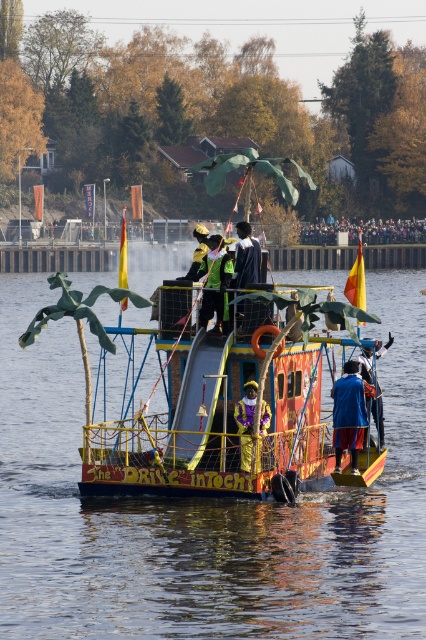
You are a photographer trying to capture both the smooth wooden boat at center and the shiny gold helmet at center in a single shot. Considering their sizes, which object should you focus on first to ensure both are in frame?

Since the smooth wooden boat at center is taller than the shiny gold helmet at center, you should focus on positioning the camera to include the taller boat first, then adjust to include the helmet within the same frame.

You are a photographer on the boat during the parade. You want to take a photo that clearly shows both the dark blue fabric jacket at center and the blue velvet hat at center. Which object should you focus on first to ensure both are in frame?

Since the dark blue fabric jacket at center is shorter than the blue velvet hat at center, you should focus on the dark blue fabric jacket at center first to ensure both are in frame.

Based on the scene described, can you determine if the smooth wooden boat at center is wider than the multicolored fabric crowd at upper center?

The smooth wooden boat at center might be wider than multicolored fabric crowd at upper center according to the description.